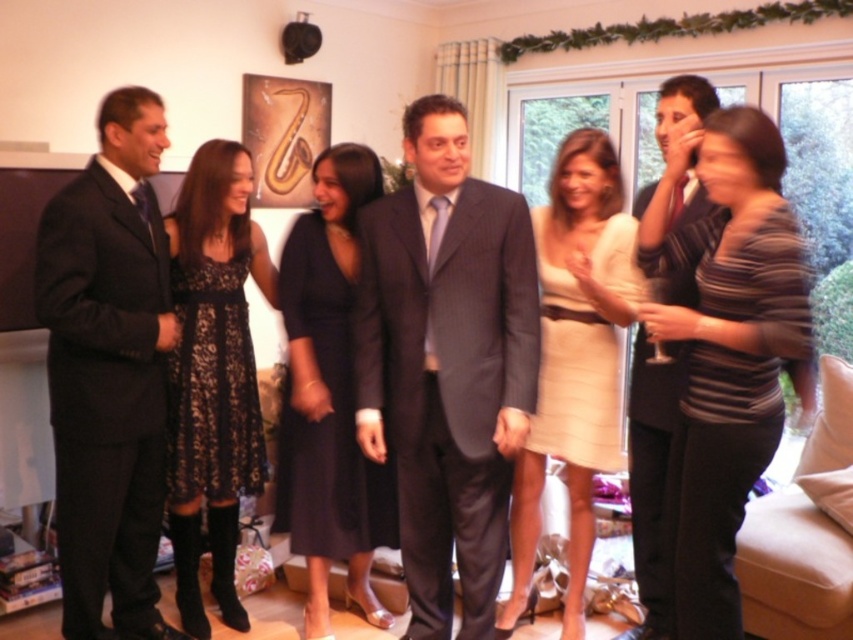
You are a photographer adjusting your camera settings to focus on two specific points in the image. The first point is at coordinates point (84, 323) and the second is at point (549, 180). Which point should you focus on first if you want to ensure both points are in sharp focus without adjusting the camera position?

You should focus on point (84, 323) first because it is closer to the camera than point (549, 180). This way, the camera can adjust the depth of field to include both points in focus.

You are planning to take a photo of the matte black suit at left and the striped fabric dress at right. Which one will appear smaller in the photo?

The matte black suit at left occupies less space than the striped fabric dress at right, so it will appear smaller in the photo.

You are standing in the living room and want to find the black satin dress at center. Which part of the room should you look towards?

You should look towards the center of the room because the black satin dress at center is located at point (329, 396), which corresponds to the central area.